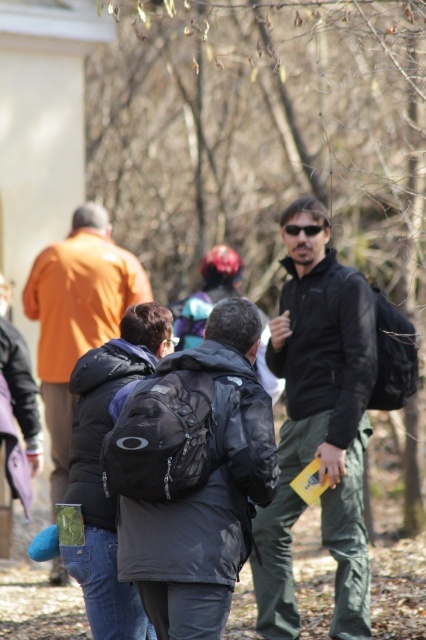
Is black matte jacket at center further to camera compared to black matte sunglasses at center?

No, black matte jacket at center is in front of black matte sunglasses at center.

Who is taller, black matte jacket at center or black matte sunglasses at center?

With more height is black matte jacket at center.

Between point (290, 211) and point (301, 230), which one is positioned behind?

Point (290, 211)

Locate an element on the screen. black matte jacket at center is located at coordinates (319, 428).

Find the location of a particular element. black matte jacket at center is located at coordinates pos(319,428).

The width and height of the screenshot is (426, 640). What do you see at coordinates (319, 428) in the screenshot?
I see `black matte jacket at center` at bounding box center [319, 428].

Between point (284, 545) and point (120, 252), which one is positioned behind?

Positioned behind is point (120, 252).

You are a GUI agent. You are given a task and a screenshot of the screen. Output one action in this format:
    pyautogui.click(x=<x>, y=<y>)
    Task: Click on the black matte jacket at center
    The height and width of the screenshot is (640, 426).
    Given the screenshot: What is the action you would take?
    pyautogui.click(x=319, y=428)

Can you confirm if orange matte jacket at left is smaller than black matte sunglasses at center?

No.

Who is more forward, (83, 250) or (313, 227)?

Point (313, 227)

Is point (83, 328) more distant than point (294, 230)?

Yes, point (83, 328) is behind point (294, 230).

This screenshot has height=640, width=426. What are the coordinates of `orange matte jacket at left` in the screenshot? It's located at (77, 314).